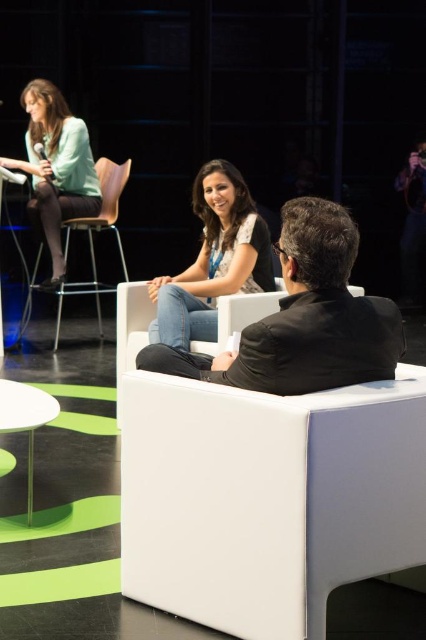
You are a stagehand preparing to adjust the lighting for the talk show. You notice the jeans at center and the white glossy table at lower left. Which object is positioned higher in the scene?

The jeans at center is above white glossy table at lower left, so the jeans at center is positioned higher in the scene.

Looking at this image, you are an event organizer arranging a panel discussion. You need to place a name tag on the table for the person in jeans. According to the scene, where should you place the name tag on the white glossy table at lower left so it is directly in front of the jeans at center?

The jeans at center is positioned on the right side of the white glossy table at lower left, so the name tag should be placed on the right side of the white glossy table at lower left to be directly in front of the jeans at center.

You are designing a layout for a magazine article about the talk show. The editor wants to highlight the jeans at center and the white glossy table at lower left. Since space is limited, they need to know which object takes up more visual space in the image. Which one is larger?

The jeans at center is larger in size than the white glossy table at lower left, so the jeans at center takes up more visual space in the image.